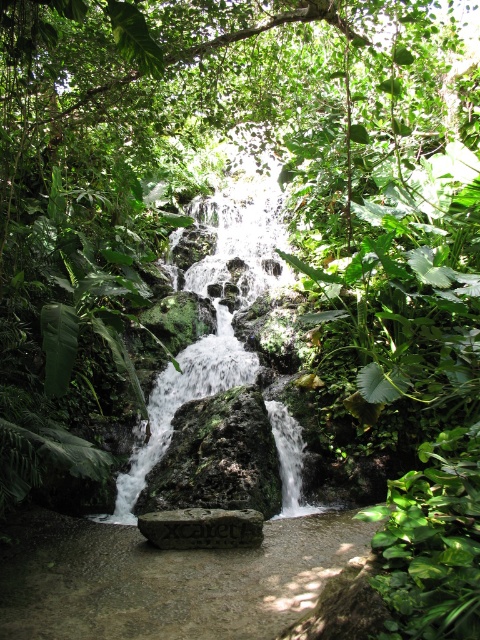
Between smooth stone path at center and gray stone at center, which one has less height?

With less height is gray stone at center.

In the scene shown: Can you confirm if smooth stone path at center is positioned to the right of gray stone at center?

Yes, smooth stone path at center is to the right of gray stone at center.

The height and width of the screenshot is (640, 480). Identify the location of smooth stone path at center. (166, 579).